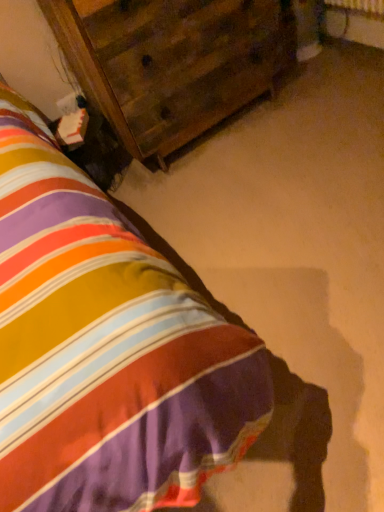
What are the coordinates of `free space in front of wooden dresser at upper left` in the screenshot? It's located at (259, 176).